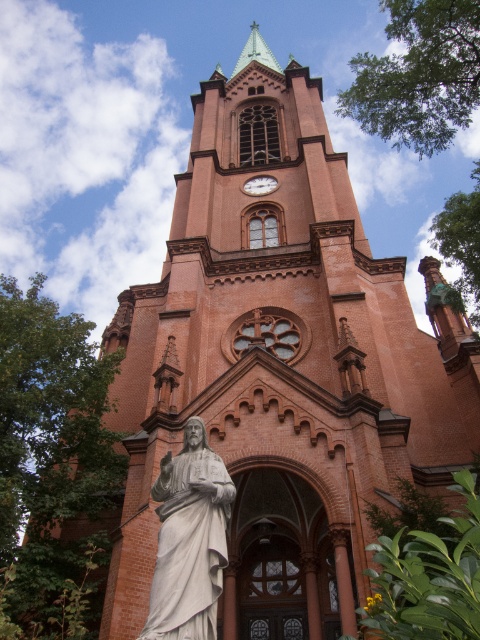
You are a tour guide explaining the church to visitors. You mention both the white marble statue at center and the matte brown clock at center. Can you tell the visitors how far apart these two landmarks are?

The white marble statue at center and the matte brown clock at center are 65.89 meters apart from each other.

You are an architect planning to install a new decorative element between the white marble statue at center and the matte brown clock at center. To ensure proper spacing, you need to know which object is wider. Can you determine which one is wider?

The white marble statue at center might be wider than matte brown clock at center according to the description.

You are an architect visiting the church and want to compare the sizes of the two main features in the scene. Which object is larger between the white marble statue at center and the matte brown clock at center?

The white marble statue at center is bigger than the matte brown clock at center according to the description.